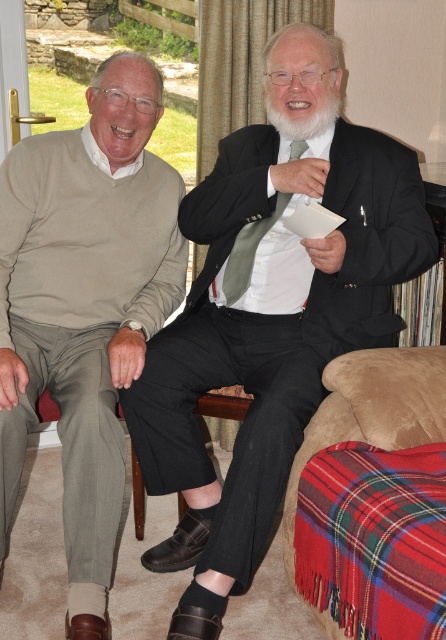
Question: Where is matte black suit at center located in relation to light beige sweater at left in the image?

Choices:
 (A) above
 (B) below

Answer: (A)

Question: Which object is closer to the camera taking this photo?

Choices:
 (A) light beige sweater at left
 (B) green silk tie at center
 (C) matte black suit at center
 (D) whitehairbeard at center

Answer: (C)

Question: Is matte black suit at center to the left of whitehairbeard at center from the viewer's perspective?

Choices:
 (A) yes
 (B) no

Answer: (A)

Question: Estimate the real-world distances between objects in this image. Which object is farther from the green silk tie at center?

Choices:
 (A) light beige sweater at left
 (B) whitehairbeard at center

Answer: (A)

Question: Can you confirm if matte black suit at center is positioned to the left of green silk tie at center?

Choices:
 (A) no
 (B) yes

Answer: (A)

Question: Considering the real-world distances, which object is closest to the matte black suit at center?

Choices:
 (A) light beige sweater at left
 (B) green silk tie at center

Answer: (B)